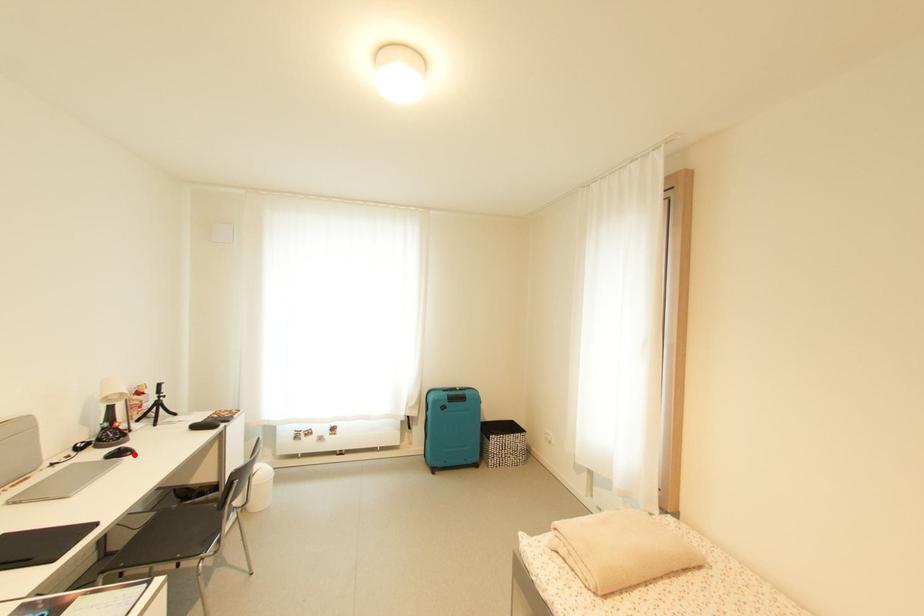
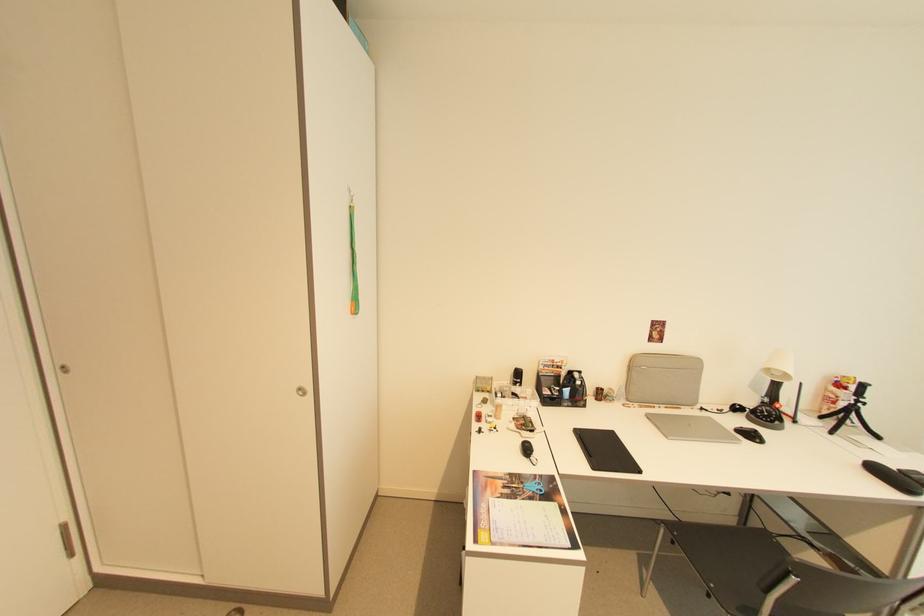
The point at the highlighted location is marked in the first image. Where is the corresponding point in the second image?

(762, 442)